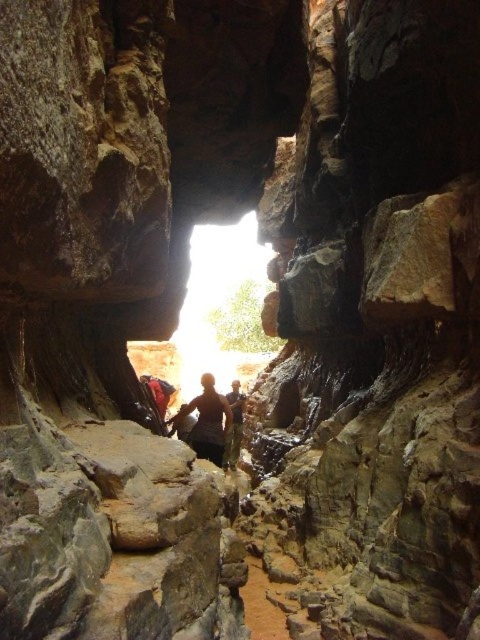
Question: Which of the following is the farthest from the observer?

Choices:
 (A) (189, 403)
 (B) (237, 404)

Answer: (A)

Question: Is dark brown leather jacket at center above camouflage pants at center?

Choices:
 (A) no
 (B) yes

Answer: (B)

Question: Can you confirm if dark brown leather jacket at center is smaller than camouflage pants at center?

Choices:
 (A) yes
 (B) no

Answer: (A)

Question: Among these objects, which one is nearest to the camera?

Choices:
 (A) camouflage pants at center
 (B) dark brown leather jacket at center

Answer: (B)

Question: Is the position of dark brown leather jacket at center less distant than that of camouflage pants at center?

Choices:
 (A) yes
 (B) no

Answer: (A)